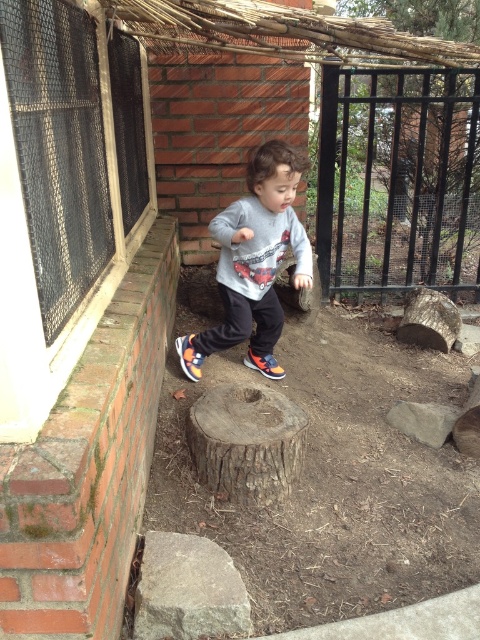
Question: Which of the following is the farthest from the observer?

Choices:
 (A) click(x=336, y=161)
 (B) click(x=416, y=410)

Answer: (A)

Question: Is metal mesh screen at left to the right of brown rough wood stump at center from the viewer's perspective?

Choices:
 (A) yes
 (B) no

Answer: (B)

Question: Which object is positioned closest to the multicolored fabric shoe at center?

Choices:
 (A) orange suede shoe at center
 (B) gray rough rock at lower left
 (C) metal mesh screen at left
 (D) brown rough wood stump at center

Answer: (A)

Question: Does metal mesh screen at left have a lesser width compared to brown rough wood stump at center?

Choices:
 (A) no
 (B) yes

Answer: (B)

Question: Which object is the farthest from the brown rough wood stump at center?

Choices:
 (A) gray rough rock at center
 (B) black metal fence at upper right
 (C) multicolored fabric shoe at center

Answer: (B)

Question: Does multicolored fabric shoe at center have a larger size compared to orange suede shoe at center?

Choices:
 (A) no
 (B) yes

Answer: (B)